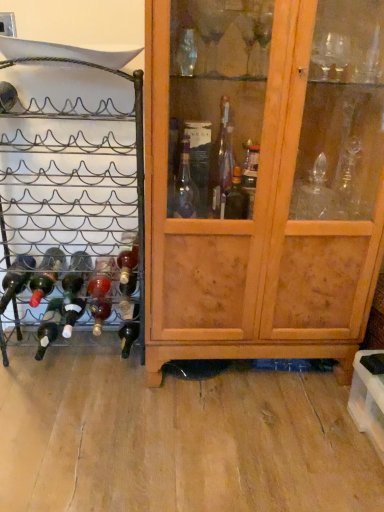
Where is `vacant space that's between matte dark brown bottle at lower left, the second bottle when ordered from left to right, and black metal wine rack at left`? The image size is (384, 512). vacant space that's between matte dark brown bottle at lower left, the second bottle when ordered from left to right, and black metal wine rack at left is located at coordinates (71, 368).